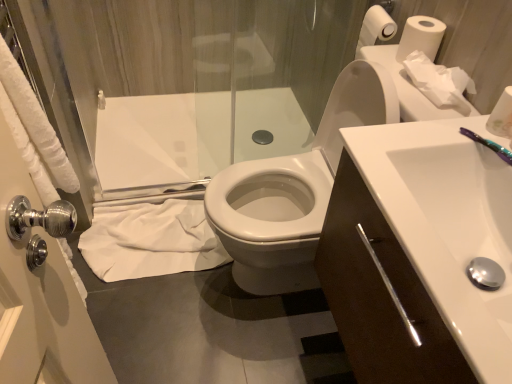
Locate an element on the screen. The height and width of the screenshot is (384, 512). vacant space to the left of white paper tissue at upper right, the second toilet paper positioned from the front is located at coordinates (391, 88).